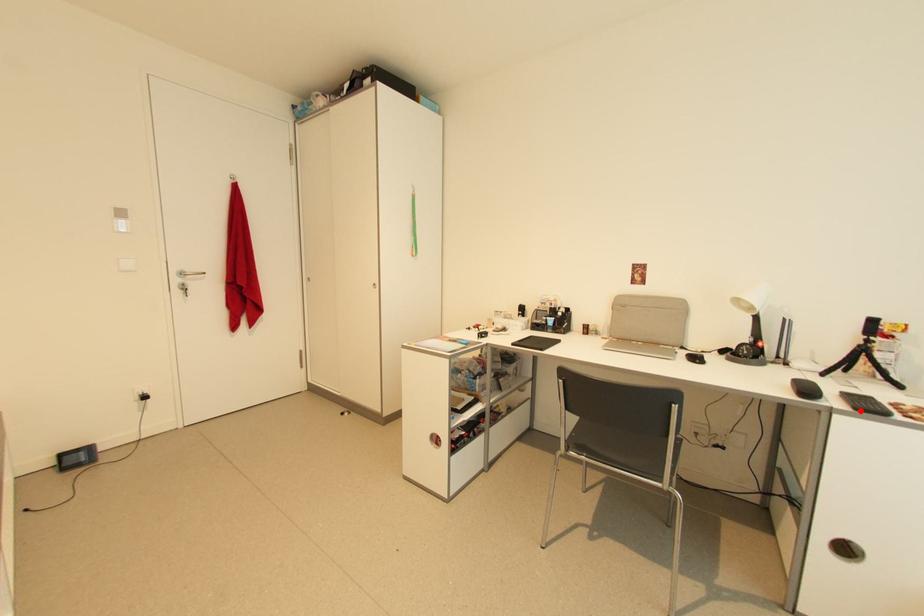
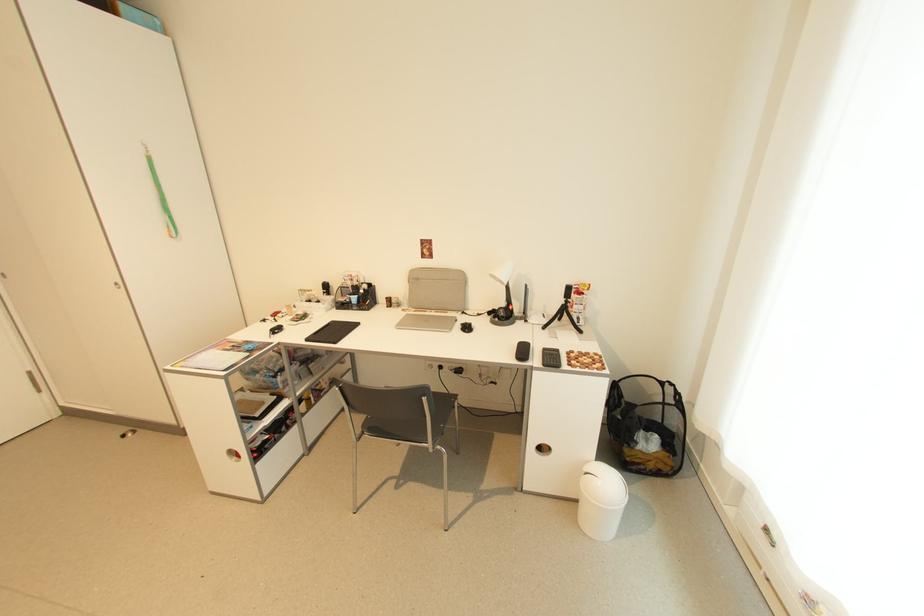
Find the pixel in the second image that matches the highlighted location in the first image.

(548, 367)